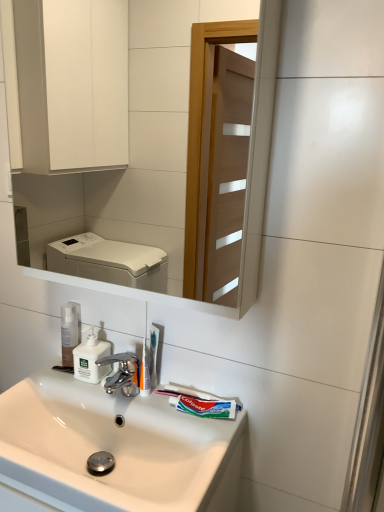
Question: Can you confirm if white glossy sink at lower center is positioned to the right of white plastic toothbrush at center, acting as the second toothbrush starting from the front?

Choices:
 (A) no
 (B) yes

Answer: (A)

Question: Would you say white glossy sink at lower center contains white plastic toothbrush at center, marked as the first toothbrush in a back-to-front arrangement?

Choices:
 (A) no
 (B) yes

Answer: (A)

Question: Could you tell me if white glossy sink at lower center is facing white plastic toothbrush at center, marked as the first toothbrush in a back-to-front arrangement?

Choices:
 (A) no
 (B) yes

Answer: (A)

Question: Is white glossy sink at lower center far from white plastic toothbrush at center, marked as the first toothbrush in a back-to-front arrangement?

Choices:
 (A) yes
 (B) no

Answer: (B)

Question: Can you confirm if white glossy sink at lower center is bigger than white plastic toothbrush at center, acting as the second toothbrush starting from the front?

Choices:
 (A) yes
 (B) no

Answer: (A)

Question: From the image's perspective, is white glossy mirror at upper center located above or below white plastic soap dispenser at center?

Choices:
 (A) above
 (B) below

Answer: (A)

Question: Would you say white glossy mirror at upper center is to the left or to the right of white plastic soap dispenser at center in the picture?

Choices:
 (A) right
 (B) left

Answer: (A)

Question: Do you think white glossy mirror at upper center is within white plastic soap dispenser at center, or outside of it?

Choices:
 (A) outside
 (B) inside

Answer: (A)

Question: Considering the positions of point (163, 82) and point (102, 340), is point (163, 82) closer or farther from the camera than point (102, 340)?

Choices:
 (A) farther
 (B) closer

Answer: (A)

Question: Is white plastic toothbrush at center, marked as the first toothbrush in a back-to-front arrangement, taller or shorter than green matte toothpaste at lower center?

Choices:
 (A) tall
 (B) short

Answer: (A)

Question: Is point (155, 355) closer or farther from the camera than point (200, 414)?

Choices:
 (A) farther
 (B) closer

Answer: (A)

Question: In terms of size, does white plastic toothbrush at center, acting as the second toothbrush starting from the front, appear bigger or smaller than green matte toothpaste at lower center?

Choices:
 (A) small
 (B) big

Answer: (A)

Question: From a real-world perspective, relative to green matte toothpaste at lower center, is white plastic toothbrush at center, marked as the first toothbrush in a back-to-front arrangement, vertically above or below?

Choices:
 (A) below
 (B) above

Answer: (B)

Question: From a real-world perspective, is transparent plastic pump bottle at center above or below white glossy sink at lower center?

Choices:
 (A) below
 (B) above

Answer: (B)

Question: Considering the positions of point (76, 321) and point (89, 410), is point (76, 321) closer or farther from the camera than point (89, 410)?

Choices:
 (A) farther
 (B) closer

Answer: (A)